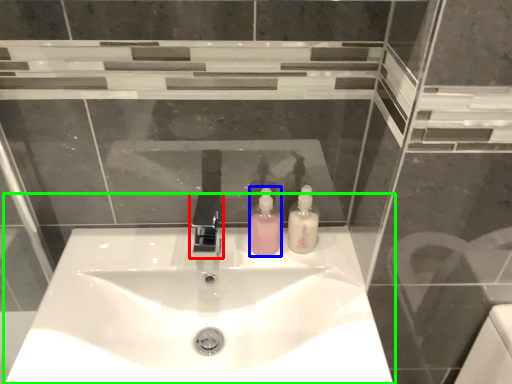
Question: Considering the real-world distances, which object is closest to tap (highlighted by a red box)? soap dispenser (highlighted by a blue box) or sink (highlighted by a green box).

Choices:
 (A) soap dispenser
 (B) sink

Answer: (A)